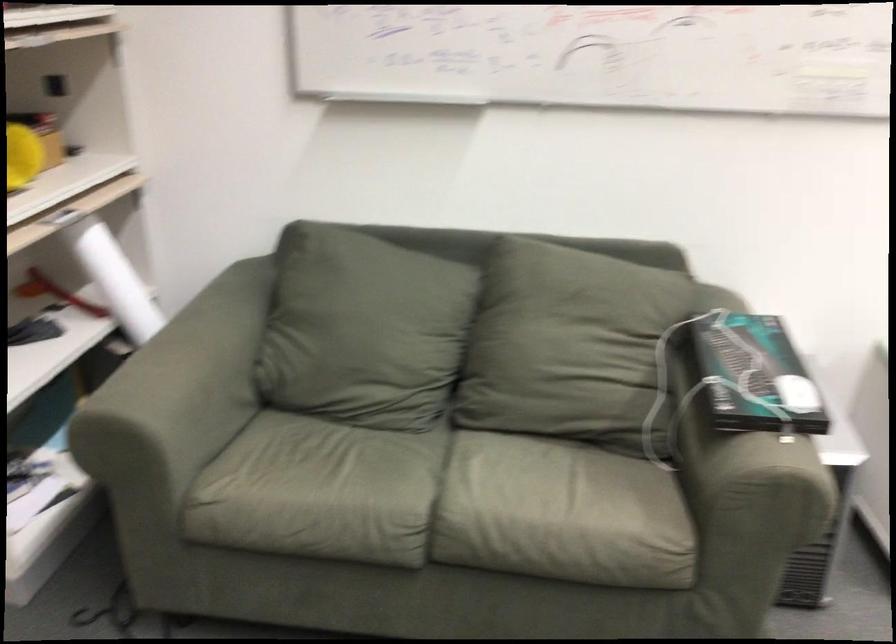
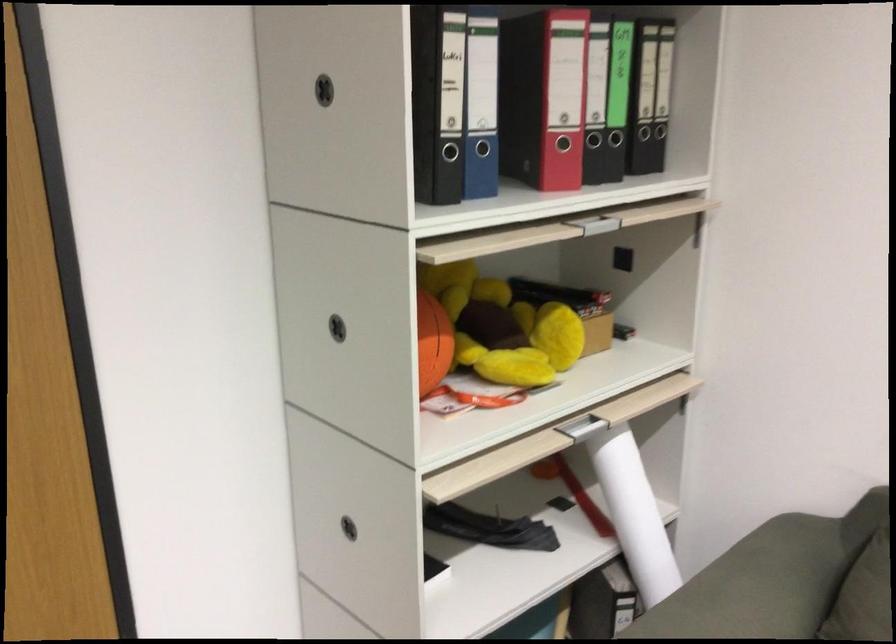
Where in the second image is the point corresponding to point (134, 292) from the first image?

(633, 514)